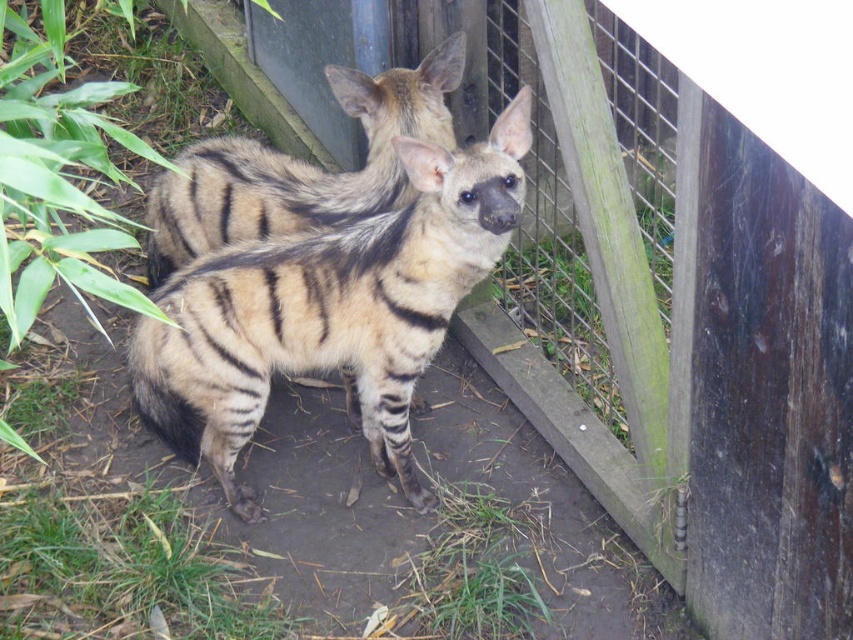
Question: Which of the following is the farthest from the observer?

Choices:
 (A) wooden fence at center
 (B) black fuzzy tail at lower left
 (C) striped fur hyena at center

Answer: (B)

Question: Which object is closer to the camera taking this photo?

Choices:
 (A) black fuzzy tail at lower left
 (B) striped fur hyaena at center
 (C) wooden fence at center

Answer: (C)

Question: Which object is the farthest from the black fuzzy tail at lower left?

Choices:
 (A) striped fur hyena at center
 (B) striped fur hyaena at center

Answer: (A)

Question: Is striped fur hyaena at center thinner than striped fur hyena at center?

Choices:
 (A) no
 (B) yes

Answer: (A)

Question: Is the position of wooden fence at center less distant than that of black fuzzy tail at lower left?

Choices:
 (A) yes
 (B) no

Answer: (A)

Question: Is wooden fence at center wider than striped fur hyena at center?

Choices:
 (A) no
 (B) yes

Answer: (B)